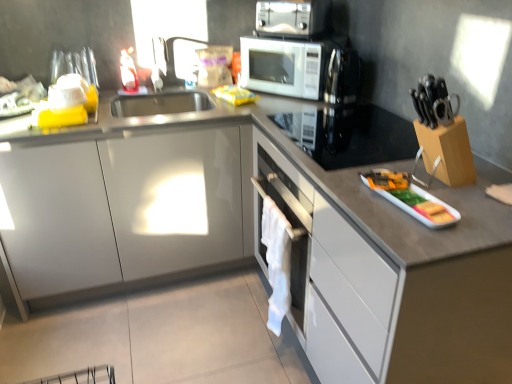
Question: Is white glossy microwave at upper center located within metallic silver toaster oven at upper center?

Choices:
 (A) no
 (B) yes

Answer: (A)

Question: Considering the relative sizes of metallic silver toaster oven at upper center and white glossy microwave at upper center in the image provided, is metallic silver toaster oven at upper center wider than white glossy microwave at upper center?

Choices:
 (A) yes
 (B) no

Answer: (A)

Question: Considering the relative sizes of metallic silver toaster oven at upper center and white glossy microwave at upper center in the image provided, is metallic silver toaster oven at upper center thinner than white glossy microwave at upper center?

Choices:
 (A) no
 (B) yes

Answer: (A)

Question: Can we say metallic silver toaster oven at upper center lies outside white glossy microwave at upper center?

Choices:
 (A) no
 (B) yes

Answer: (B)

Question: Is metallic silver toaster oven at upper center smaller than white glossy microwave at upper center?

Choices:
 (A) yes
 (B) no

Answer: (A)

Question: From the image's perspective, is metallic silver toaster oven at upper center located beneath white glossy microwave at upper center?

Choices:
 (A) yes
 (B) no

Answer: (B)

Question: From a real-world perspective, is white glossy tray at right, the 1th appliance viewed from the front, on yellow plastic bag at upper center?

Choices:
 (A) yes
 (B) no

Answer: (B)

Question: From a real-world perspective, is white glossy tray at right, the second appliance in the top-to-bottom sequence, physically below yellow plastic bag at upper center?

Choices:
 (A) no
 (B) yes

Answer: (B)

Question: Is white glossy tray at right, the second appliance in the top-to-bottom sequence, bigger than yellow plastic bag at upper center?

Choices:
 (A) yes
 (B) no

Answer: (A)

Question: Is white glossy tray at right, marked as the second appliance in a back-to-front arrangement, taller than yellow plastic bag at upper center?

Choices:
 (A) no
 (B) yes

Answer: (A)

Question: Is white glossy tray at right, which appears as the 1th appliance when ordered from the bottom, in contact with yellow plastic bag at upper center?

Choices:
 (A) no
 (B) yes

Answer: (A)

Question: Is white glossy tray at right, marked as the second appliance in a back-to-front arrangement, shorter than yellow plastic bag at upper center?

Choices:
 (A) no
 (B) yes

Answer: (B)

Question: Is white glossy tray at right, which appears as the 1th appliance when ordered from the bottom, at the right side of white glossy microwave at upper center?

Choices:
 (A) no
 (B) yes

Answer: (B)